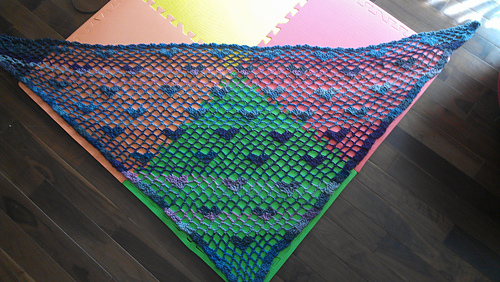
I want to click on corner, so click(x=469, y=29).